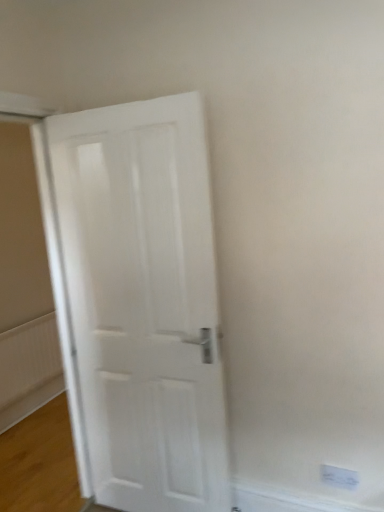
Question: Is white matte door at center taller or shorter than white textured radiator at lower left?

Choices:
 (A) tall
 (B) short

Answer: (A)

Question: From the image's perspective, is white matte door at center above or below white textured radiator at lower left?

Choices:
 (A) below
 (B) above

Answer: (B)

Question: Estimate the real-world distances between objects in this image. Which object is farther from the white plastic electric outlet at lower right?

Choices:
 (A) white textured radiator at lower left
 (B) white matte door at center

Answer: (A)

Question: Which of these objects is positioned closest to the white textured radiator at lower left?

Choices:
 (A) white matte door at center
 (B) white plastic electric outlet at lower right

Answer: (A)